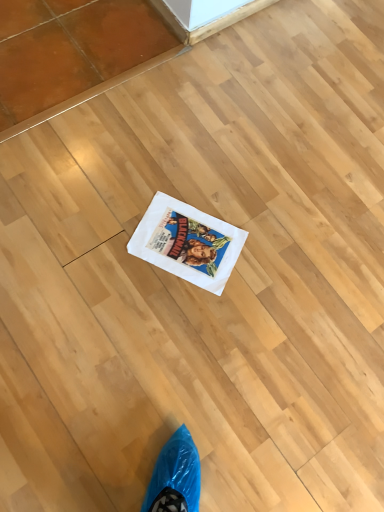
Identify the location of vacant space underneath white paper comic book at center (from a real-world perspective). The image size is (384, 512). (193, 241).